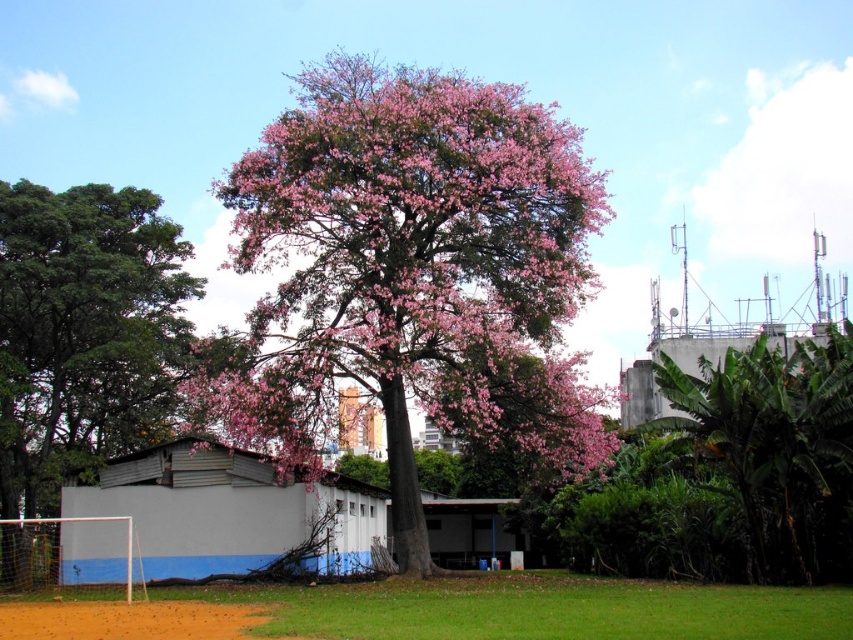
Can you confirm if green leafy tree at left is bigger than brown sandy dirt field at lower left?

Correct, green leafy tree at left is larger in size than brown sandy dirt field at lower left.

Between green leafy tree at left and brown sandy dirt field at lower left, which one has less height?

With less height is brown sandy dirt field at lower left.

The width and height of the screenshot is (853, 640). What do you see at coordinates (85, 333) in the screenshot? I see `green leafy tree at left` at bounding box center [85, 333].

Identify the location of green leafy tree at left. This screenshot has height=640, width=853. coord(85,333).

Can you confirm if pink matte tree at center is positioned to the left of green leafy tree at right?

Yes, pink matte tree at center is to the left of green leafy tree at right.

Where is `pink matte tree at center`? The image size is (853, 640). pink matte tree at center is located at coordinates (413, 273).

Which is more to the left, green leafy tree at right or brown sandy dirt field at lower left?

Positioned to the left is brown sandy dirt field at lower left.

In the scene shown: Can you confirm if green leafy tree at right is positioned below brown sandy dirt field at lower left?

No, green leafy tree at right is not below brown sandy dirt field at lower left.

Is point (817, 486) less distant than point (194, 605)?

No, (817, 486) is behind (194, 605).

The width and height of the screenshot is (853, 640). What are the coordinates of `green leafy tree at right` in the screenshot? It's located at (775, 445).